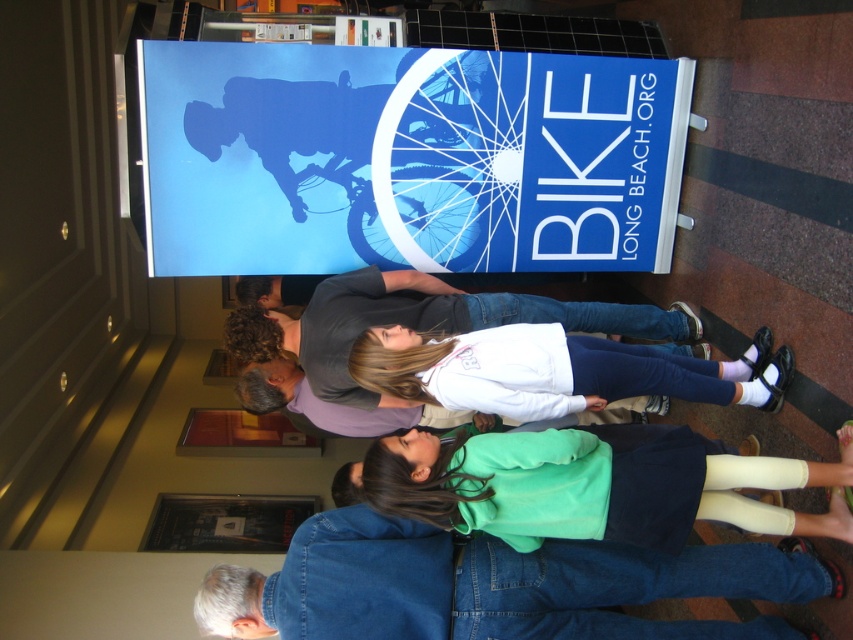
You are a photographer at the event and want to capture a photo of the green fleece sweatshirt at center without the denim jeans at lower center blocking the view. Is this possible based on their positions?

The denim jeans at lower center is further to the viewer than the green fleece sweatshirt at center, so the denim jeans would block the view of the green fleece sweatshirt at center. Therefore, it is not possible to capture the green fleece sweatshirt at center without obstruction.

You are a photographer trying to capture a candid shot of the group. Since the denim jeans at lower center and the green fleece sweatshirt at center are in your frame, which clothing item should you focus on to ensure it takes up more of the photo?

The green fleece sweatshirt at center occupies more space in the frame than the denim jeans at lower center, so focusing on it will ensure it takes up more of the photo.